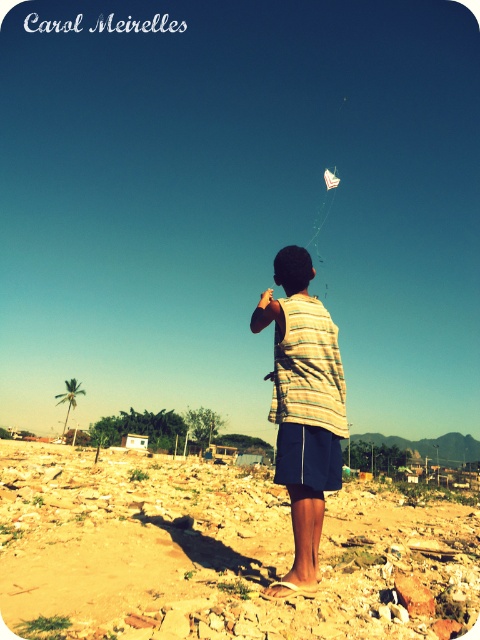
In the scene shown: Is striped fabric shirt at center further to camera compared to white paper kite at upper center?

No, it is in front of white paper kite at upper center.

Who is positioned more to the right, striped fabric shirt at center or white paper kite at upper center?

From the viewer's perspective, white paper kite at upper center appears more on the right side.

Is point (315, 442) less distant than point (324, 173)?

Yes, point (315, 442) is in front of point (324, 173).

Where is `striped fabric shirt at center`? The width and height of the screenshot is (480, 640). striped fabric shirt at center is located at coordinates (302, 410).

Can you confirm if brown rocky dirt at center is positioned to the left of striped fabric shirt at center?

Indeed, brown rocky dirt at center is positioned on the left side of striped fabric shirt at center.

Is brown rocky dirt at center bigger than striped fabric shirt at center?

Yes, brown rocky dirt at center is bigger than striped fabric shirt at center.

Is point (397, 611) positioned before point (335, 452)?

Yes, point (397, 611) is closer to viewer.

Where is `brown rocky dirt at center`? This screenshot has width=480, height=640. brown rocky dirt at center is located at coordinates (215, 552).

Can you confirm if brown rocky dirt at center is wider than white paper kite at upper center?

Correct, the width of brown rocky dirt at center exceeds that of white paper kite at upper center.

Is brown rocky dirt at center to the right of white paper kite at upper center from the viewer's perspective?

Incorrect, brown rocky dirt at center is not on the right side of white paper kite at upper center.

Describe the element at coordinates (215, 552) in the screenshot. I see `brown rocky dirt at center` at that location.

Where is `brown rocky dirt at center`? brown rocky dirt at center is located at coordinates (215, 552).